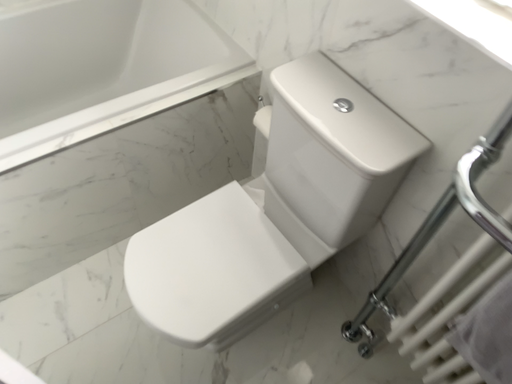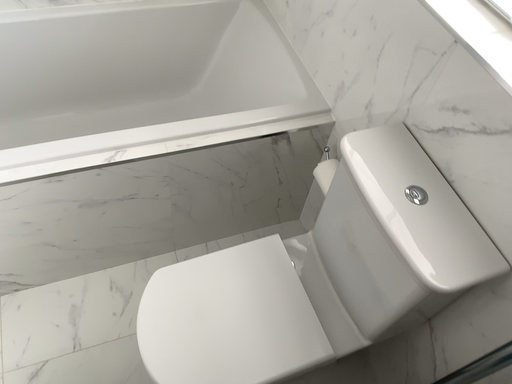
Question: Which way did the camera rotate in the video?

Choices:
 (A) rotated left
 (B) rotated right

Answer: (A)